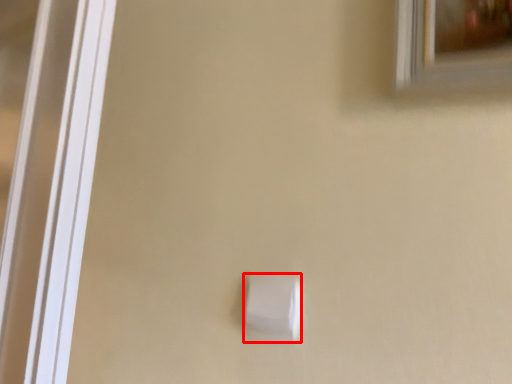
Question: From the image, what is the correct spatial relationship of light switch (annotated by the red box) in relation to window?

Choices:
 (A) left
 (B) right

Answer: (A)